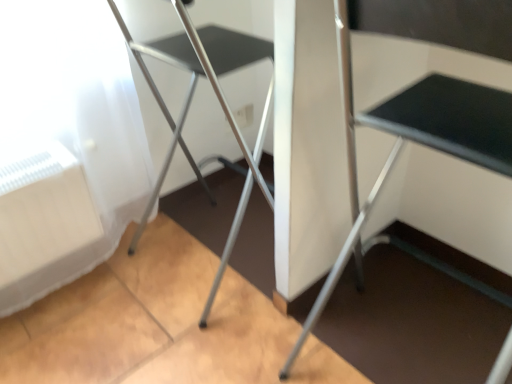
Question: Is metallic silver chair at left oriented towards silver metallic folding table at center?

Choices:
 (A) yes
 (B) no

Answer: (B)

Question: Considering the relative positions of metallic silver chair at left and silver metallic folding table at center in the image provided, is metallic silver chair at left to the right of silver metallic folding table at center from the viewer's perspective?

Choices:
 (A) yes
 (B) no

Answer: (B)

Question: Considering the relative sizes of metallic silver chair at left and silver metallic folding table at center in the image provided, is metallic silver chair at left thinner than silver metallic folding table at center?

Choices:
 (A) yes
 (B) no

Answer: (A)

Question: Is metallic silver chair at left bigger than silver metallic folding table at center?

Choices:
 (A) no
 (B) yes

Answer: (A)

Question: Is metallic silver chair at left taller than silver metallic folding table at center?

Choices:
 (A) no
 (B) yes

Answer: (A)

Question: Is the position of metallic silver chair at left more distant than that of silver metallic folding table at center?

Choices:
 (A) no
 (B) yes

Answer: (B)

Question: Is silver metallic folding table at center beside metallic silver chair at left?

Choices:
 (A) no
 (B) yes

Answer: (A)

Question: Is silver metallic folding table at center to the right of metallic silver chair at left from the viewer's perspective?

Choices:
 (A) no
 (B) yes

Answer: (B)

Question: Could you tell me if silver metallic folding table at center is turned towards metallic silver chair at left?

Choices:
 (A) no
 (B) yes

Answer: (A)

Question: Is silver metallic folding table at center not within metallic silver chair at left?

Choices:
 (A) yes
 (B) no

Answer: (A)

Question: From the image's perspective, is silver metallic folding table at center under metallic silver chair at left?

Choices:
 (A) no
 (B) yes

Answer: (B)

Question: Considering the relative positions of silver metallic folding table at center and metallic silver chair at left in the image provided, is silver metallic folding table at center behind metallic silver chair at left?

Choices:
 (A) no
 (B) yes

Answer: (A)

Question: From the image's perspective, is silver metallic folding table at center above or below metallic silver chair at left?

Choices:
 (A) below
 (B) above

Answer: (A)